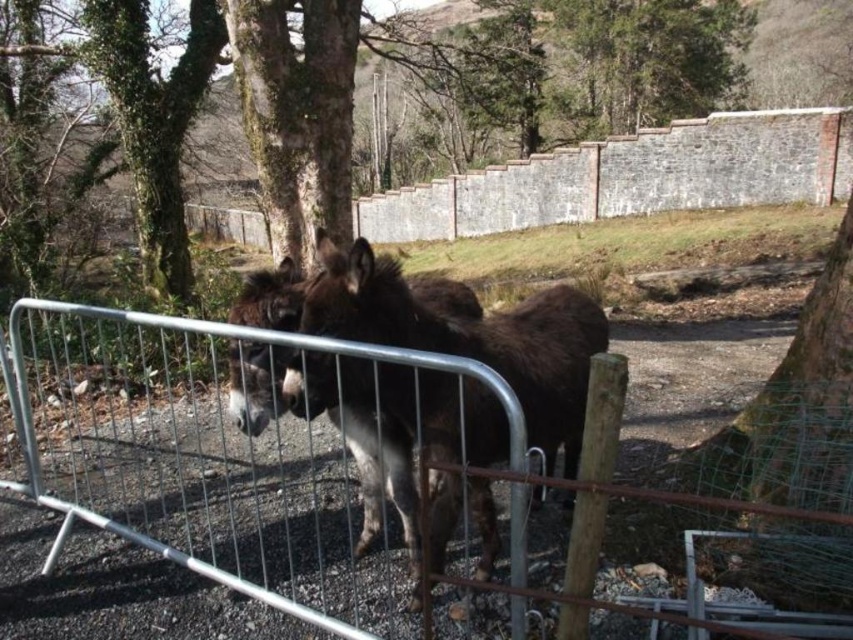
Question: Which point is farther from the camera taking this photo?

Choices:
 (A) (379, 332)
 (B) (344, 132)

Answer: (B)

Question: Does dark brown fur mule at center have a smaller size compared to brown rough bark tree at upper center?

Choices:
 (A) yes
 (B) no

Answer: (B)

Question: Estimate the real-world distances between objects in this image. Which object is closer to the dark brown fur mule at center?

Choices:
 (A) brown rough bark tree at upper center
 (B) silver metallic fence at center

Answer: (B)

Question: Is silver metallic fence at center smaller than dark brown fur mule at center?

Choices:
 (A) no
 (B) yes

Answer: (B)

Question: Which object appears closest to the camera in this image?

Choices:
 (A) brown rough bark tree at upper center
 (B) dark brown fur mule at center

Answer: (B)

Question: Is silver metallic fence at center to the right of brown rough bark tree at upper center from the viewer's perspective?

Choices:
 (A) yes
 (B) no

Answer: (B)